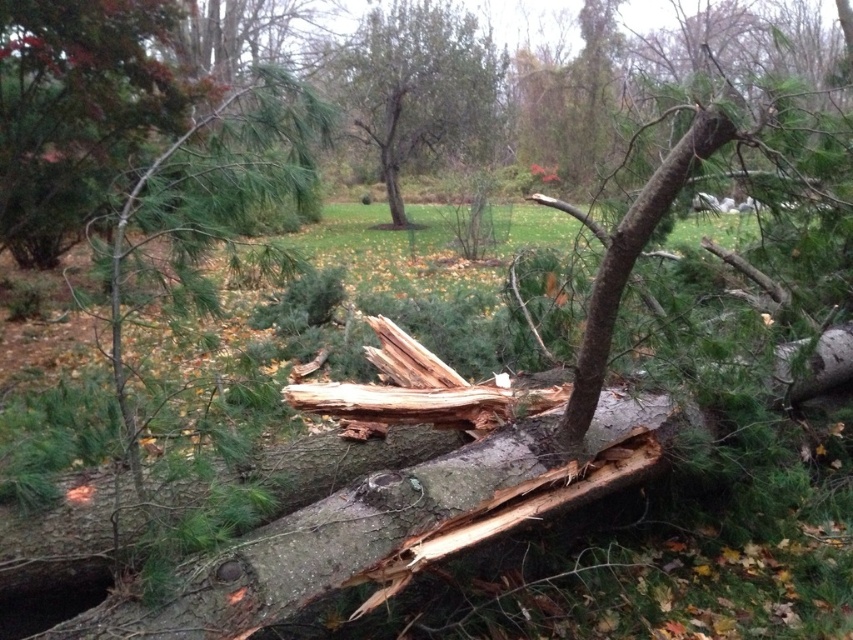
Is smooth bark log at center taller than green matte pine branch at upper left?

Incorrect, smooth bark log at center's height is not larger of green matte pine branch at upper left's.

Is smooth bark log at center in front of green matte pine branch at upper left?

That is True.

Is point (228, 600) positioned before point (128, 65)?

Yes, point (228, 600) is in front of point (128, 65).

Identify the location of smooth bark log at center. The width and height of the screenshot is (853, 640). (392, 524).

Which is below, smooth bark log at center or green rough bark tree at center?

Positioned lower is smooth bark log at center.

Can you confirm if smooth bark log at center is thinner than green rough bark tree at center?

Yes.

Which is behind, point (302, 518) or point (383, 116)?

The point (383, 116) is behind.

You are a GUI agent. You are given a task and a screenshot of the screen. Output one action in this format:
    pyautogui.click(x=<x>, y=<y>)
    Task: Click on the smooth bark log at center
    
    Given the screenshot: What is the action you would take?
    pyautogui.click(x=392, y=524)

Does green matte pine branch at upper left have a greater height compared to green rough bark tree at center?

Incorrect, green matte pine branch at upper left's height is not larger of green rough bark tree at center's.

Who is more forward, (36,176) or (465,83)?

Point (36,176) is more forward.

Who is more forward, (64, 164) or (468, 42)?

Point (64, 164) is in front.

I want to click on green matte pine branch at upper left, so click(x=77, y=113).